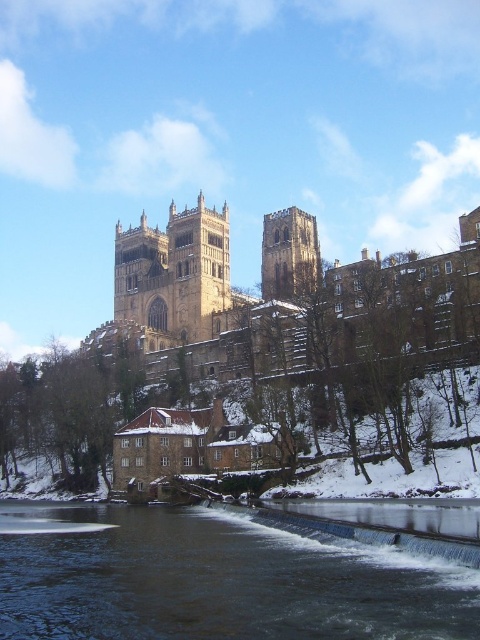
Question: Considering the real-world distances, which object is closest to the brown stone tower at center?

Choices:
 (A) dark gray water at lower center
 (B) golden stone castle at center
 (C) golden stone tower at center

Answer: (B)

Question: Does dark gray water at lower center appear on the left side of golden stone castle at center?

Choices:
 (A) yes
 (B) no

Answer: (A)

Question: Does golden stone castle at center have a greater width compared to brown stone tower at center?

Choices:
 (A) yes
 (B) no

Answer: (A)

Question: In this image, where is golden stone castle at center located relative to brown stone tower at center?

Choices:
 (A) above
 (B) below

Answer: (B)

Question: Which point is farther from the camera taking this photo?

Choices:
 (A) (310, 228)
 (B) (144, 237)
 (C) (470, 572)

Answer: (B)

Question: Which object is the closest to the golden stone castle at center?

Choices:
 (A) dark gray water at lower center
 (B) golden stone tower at center

Answer: (B)